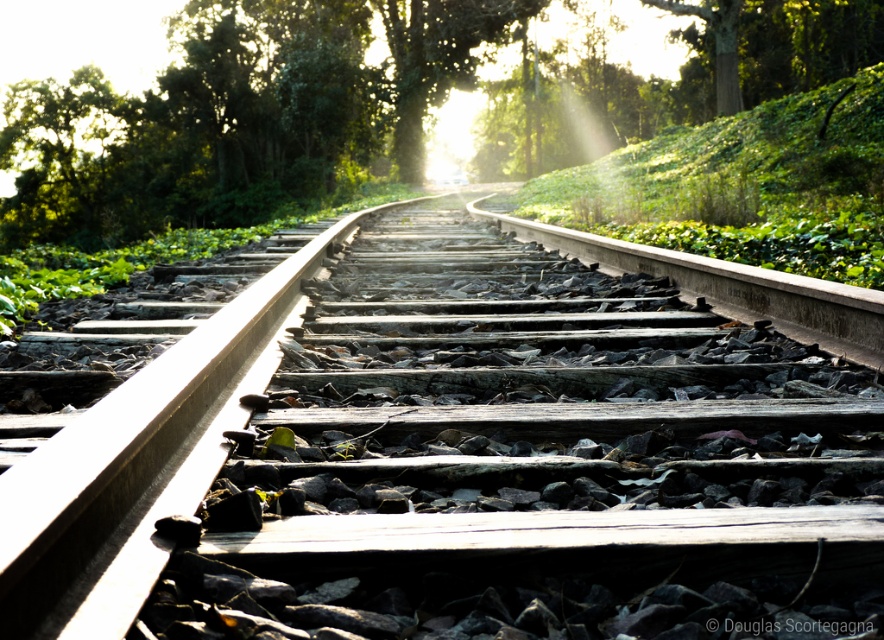
You are standing at the starting point of the railway track and see the wooden track at center and the green leafy tree at center. Which object is positioned to the right side from your perspective?

The wooden track at center is to the right of the green leafy tree at center, so the wooden track at center is positioned to the right side from your perspective.